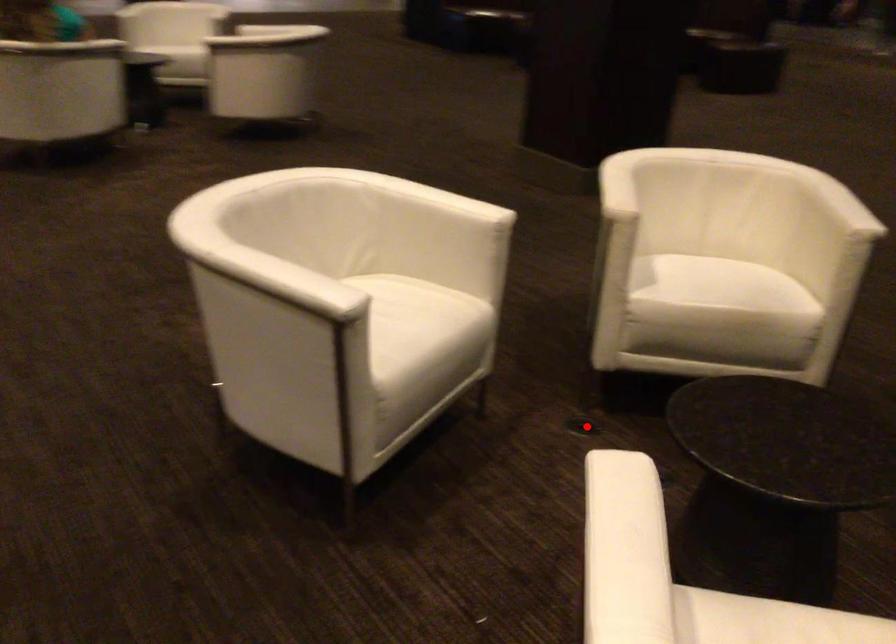
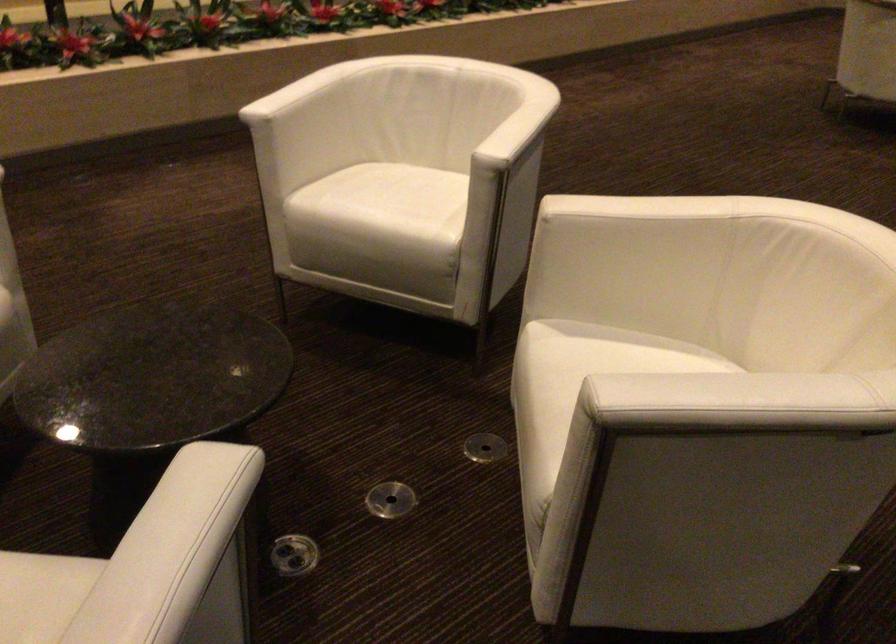
Question: I am providing you with two images of the same scene from different viewpoints. Given a red point in image1, look at the same physical point in image2. Is it:

Choices:
 (A) Closer to the viewpoint
 (B) Farther from the viewpoint

Answer: (A)